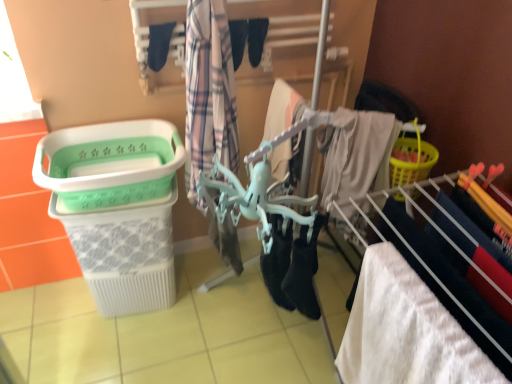
Question: Should I look upward or downward to see plaid fabric at center, the first clothing when ordered from right to left?

Choices:
 (A) down
 (B) up

Answer: (B)

Question: From a real-world perspective, is black fabric socks at upper center, which is the 2th clothing in right-to-left order, positioned under black fabric shoe at center, the 1th shoe viewed from the right, based on gravity?

Choices:
 (A) yes
 (B) no

Answer: (A)

Question: Is black fabric socks at upper center, which is the 2th clothing in right-to-left order, not close to black fabric shoe at center, the 1th shoe viewed from the right?

Choices:
 (A) yes
 (B) no

Answer: (B)

Question: Would you say black fabric socks at upper center, placed as the first clothing when sorted from left to right, contains black fabric shoe at center, the 1th shoe viewed from the right?

Choices:
 (A) yes
 (B) no

Answer: (B)

Question: Does black fabric socks at upper center, placed as the first clothing when sorted from left to right, touch black fabric shoe at center, which is the 2th shoe in left-to-right order?

Choices:
 (A) no
 (B) yes

Answer: (A)

Question: Could you tell me if black fabric socks at upper center, which is the 2th clothing in right-to-left order, is facing black fabric shoe at center, which is the 2th shoe in left-to-right order?

Choices:
 (A) no
 (B) yes

Answer: (A)

Question: Is black fabric socks at upper center, which is the 2th clothing in right-to-left order, bigger than black fabric shoe at center, the 1th shoe viewed from the right?

Choices:
 (A) yes
 (B) no

Answer: (B)

Question: Does white fluffy towel at lower right have a larger size compared to green plastic laundry basket at left?

Choices:
 (A) no
 (B) yes

Answer: (A)

Question: Can you confirm if white fluffy towel at lower right is positioned to the right of green plastic laundry basket at left?

Choices:
 (A) yes
 (B) no

Answer: (A)

Question: From the image's perspective, is white fluffy towel at lower right over green plastic laundry basket at left?

Choices:
 (A) no
 (B) yes

Answer: (A)

Question: From the image's perspective, is white fluffy towel at lower right beneath green plastic laundry basket at left?

Choices:
 (A) yes
 (B) no

Answer: (A)

Question: Is white fluffy towel at lower right outside green plastic laundry basket at left?

Choices:
 (A) no
 (B) yes

Answer: (B)

Question: Is the depth of white fluffy towel at lower right less than that of green plastic laundry basket at left?

Choices:
 (A) yes
 (B) no

Answer: (A)

Question: Can you confirm if black fabric socks at upper center, placed as the first clothing when sorted from left to right, is positioned to the left of black fabric shoe at center, the second shoe when ordered from right to left?

Choices:
 (A) no
 (B) yes

Answer: (B)